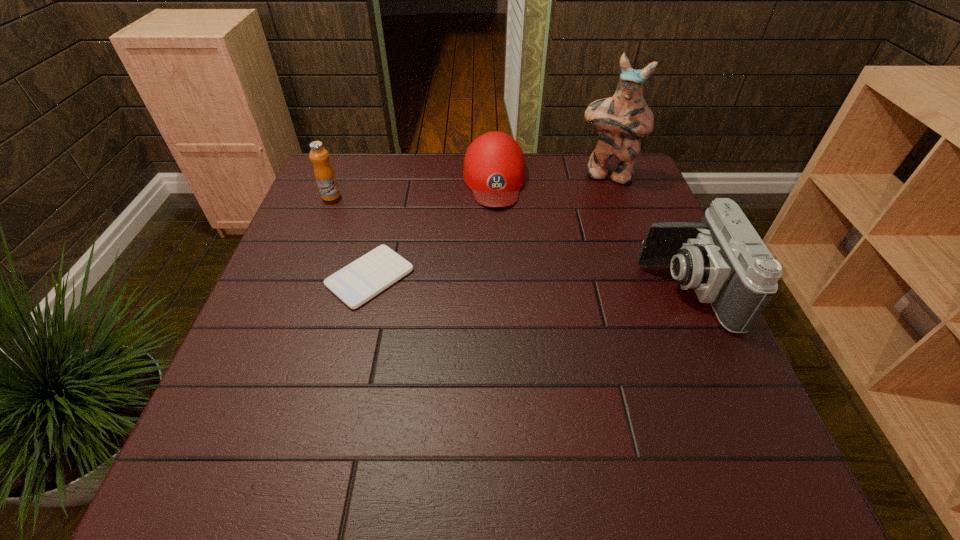
Identify the location of vacant spot on the desktop that is between the fourth object from right to left and the camera and is positioned on the front label of the orange juice. This screenshot has width=960, height=540. (510, 282).

At what (x,y) coordinates should I click in order to perform the action: click on vacant space on the desktop that is between the second object from left to right and the camera and is positioned on the front-facing side of the baseball cap. Please return your answer as a coordinate pair (x, y). This screenshot has height=540, width=960. Looking at the image, I should click on pos(505,282).

This screenshot has height=540, width=960. In order to click on vacant spot on the desktop that is between the second object from left to right and the camera and is positioned on the front-facing side of the figurine in this screenshot , I will do `click(569, 285)`.